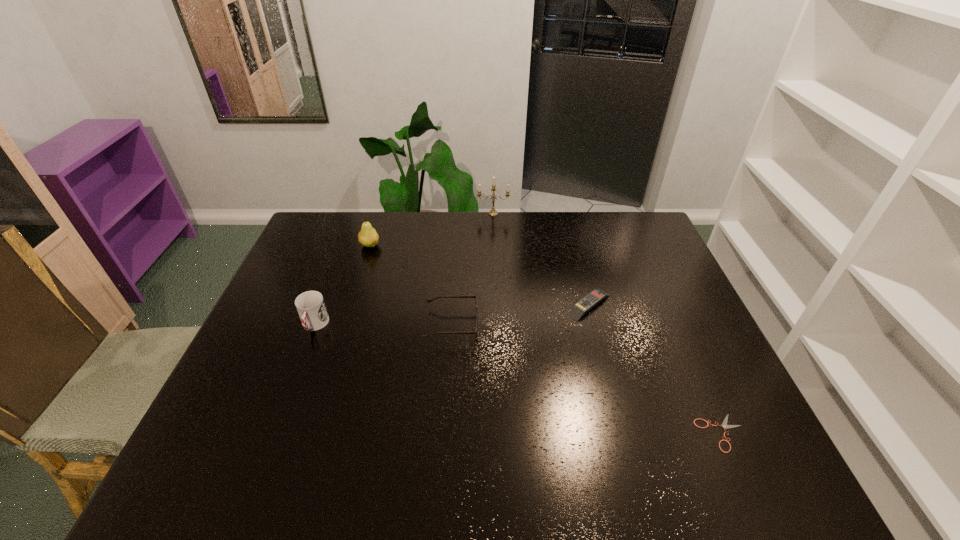
I want to click on candle, so click(x=493, y=212).

Find the location of a particular element. the farthest object is located at coordinates [x=493, y=212].

Identify the location of the fifth nearest object. (368, 237).

Where is `pear`? pear is located at coordinates (368, 237).

The width and height of the screenshot is (960, 540). What are the coordinates of `cup` in the screenshot? It's located at click(310, 305).

Locate an element on the screen. the third tallest object is located at coordinates (310, 305).

What are the coordinates of `the fourth tallest object` in the screenshot? It's located at (429, 300).

Locate an element on the screen. remote control is located at coordinates (596, 296).

This screenshot has height=540, width=960. What are the coordinates of `the fifth object from left to right` in the screenshot? It's located at (596, 296).

The image size is (960, 540). What are the coordinates of `the rightmost object` in the screenshot? It's located at (724, 424).